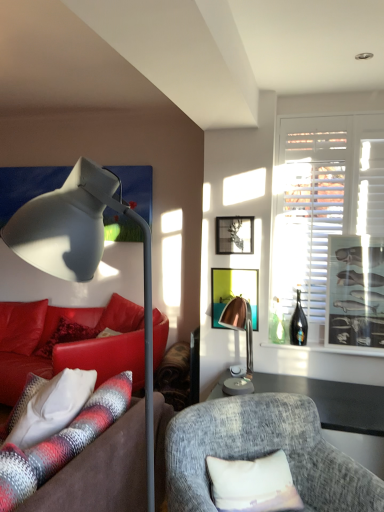
Where is `empty space that is ontop of metallic silver picture frame at right, which is the first picture frame in right-to-left order`? This screenshot has width=384, height=512. empty space that is ontop of metallic silver picture frame at right, which is the first picture frame in right-to-left order is located at coordinates (362, 228).